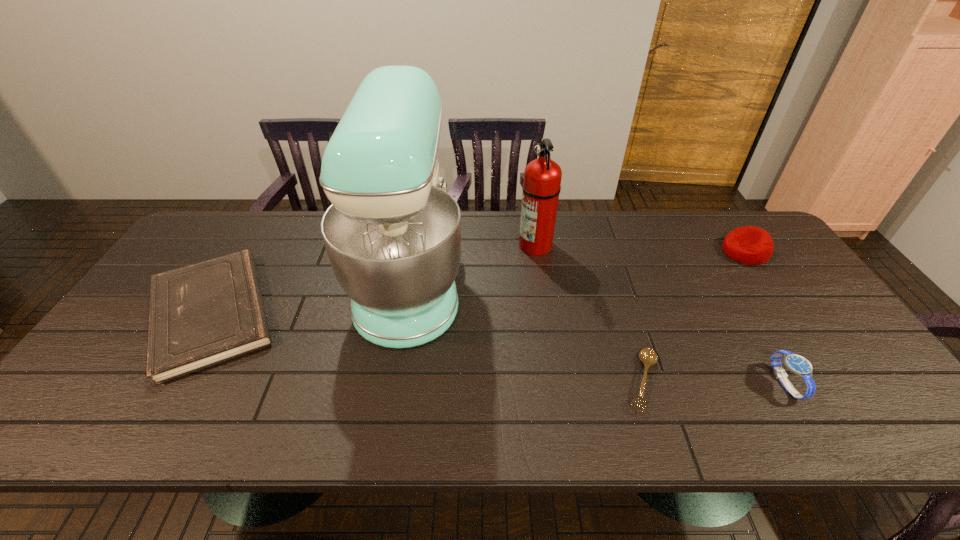
Identify the location of vacant area that lies between the fifth tallest object and the second object from left to right. (311, 296).

Locate an element on the screen. The image size is (960, 540). vacant area between the fire extinguisher and the shortest object is located at coordinates (589, 313).

Identify the location of unoccupied area between the fourth object from left to right and the watch. click(x=714, y=382).

Find the location of `object that stands as the closest to the second object from left to right`. object that stands as the closest to the second object from left to right is located at coordinates (206, 313).

The height and width of the screenshot is (540, 960). I want to click on the fifth closest object to the paperback book, so point(750,245).

Locate an element on the screen. This screenshot has height=540, width=960. vacant space that satisfies the following two spatial constraints: 1. at the nozzle of the fire extinguisher; 2. on the right side of the third object from right to left is located at coordinates (555, 381).

Find the location of a particular element. vacant space that satisfies the following two spatial constraints: 1. on the back side of the third object from right to left; 2. at the base of the tallest object is located at coordinates (612, 280).

Find the location of a particular element. free location that satisfies the following two spatial constraints: 1. on the back side of the watch; 2. at the base of the fifth object from right to left is located at coordinates (725, 280).

Locate an element on the screen. This screenshot has height=540, width=960. free spot that satisfies the following two spatial constraints: 1. at the base of the ladle; 2. on the left side of the tallest object is located at coordinates (394, 381).

The image size is (960, 540). What are the coordinates of `vacant region that satisfies the following two spatial constraints: 1. on the seat area of the beanbag; 2. on the front side of the leftmost object` in the screenshot? It's located at (786, 313).